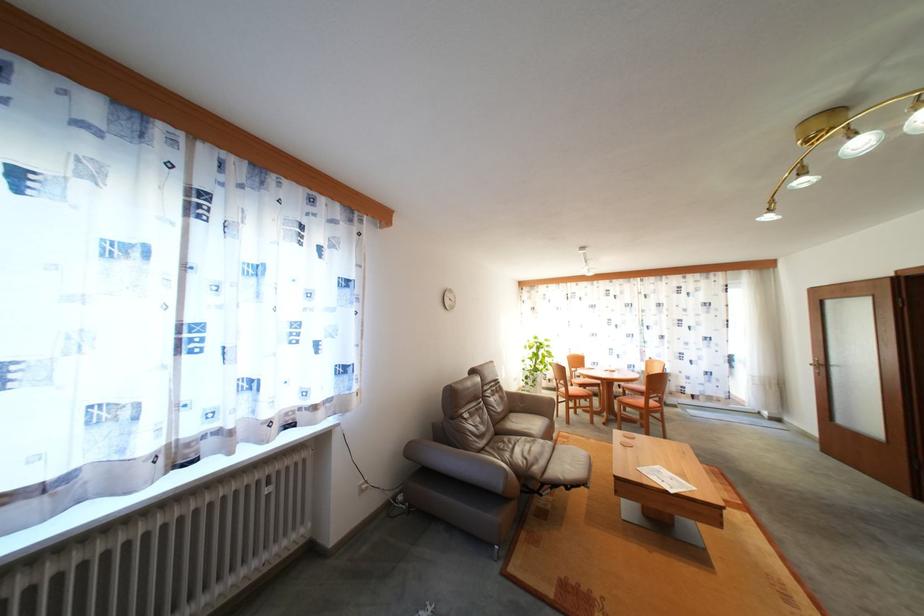
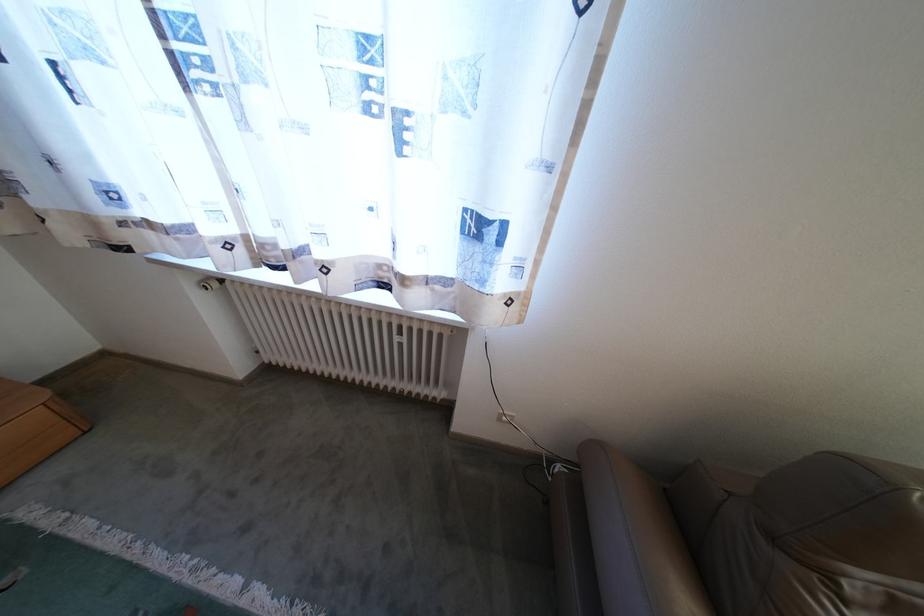
The point at (371, 491) is marked in the first image. Where is the corresponding point in the second image?

(512, 419)